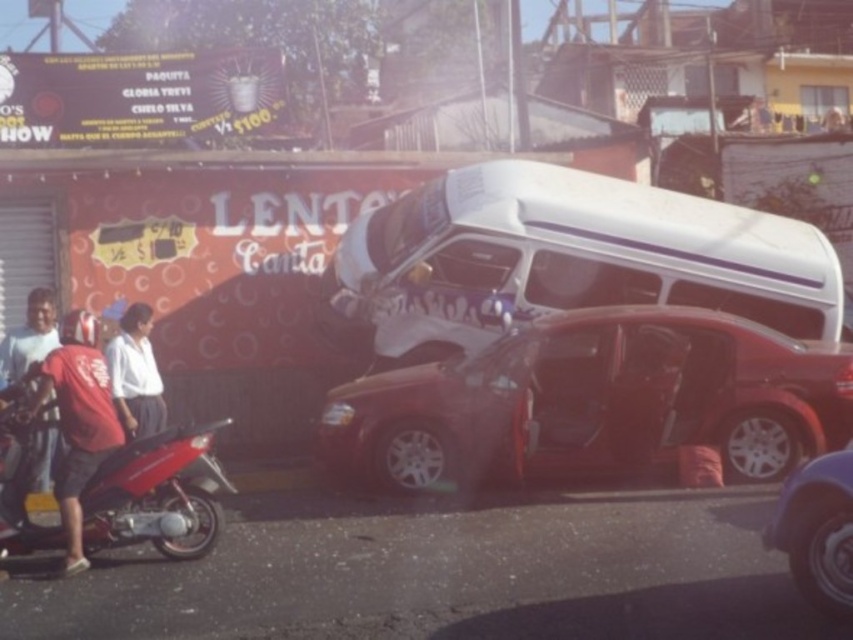
You are a pedestrian standing on the sidewalk. You see a shiny red sedan at center and a matte white shirt at left. Which object is closer to the left side of the road?

The matte white shirt at left is closer to the left side of the road because the shiny red sedan at center is positioned to its right.

You are a delivery driver who needs to park your vehicle in the area shown. The parking spot you want is located at coordinate point 0.402, 0.672. Is the white glossy van at center currently occupying this spot?

The white glossy van at center is positioned at point [572,257], so yes, it is occupying the parking spot you want.

You are a pedestrian standing at the edge of the street scene described. You notice the shiny red sedan at center and the matte white shirt at left. Which object takes up more space in the image?

The shiny red sedan at center is larger in size than the matte white shirt at left, so it takes up more space in the image.